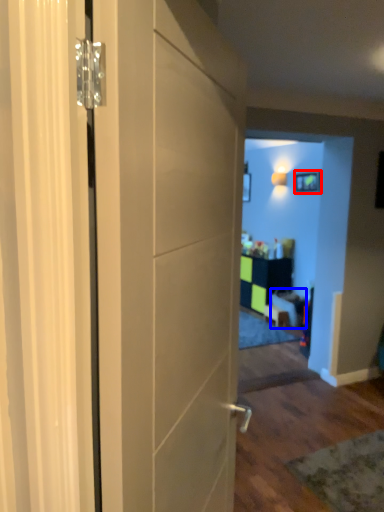
Question: Which point is further to the camera, picture frame (highlighted by a red box) or furniture (highlighted by a blue box)?

Choices:
 (A) picture frame
 (B) furniture

Answer: (A)